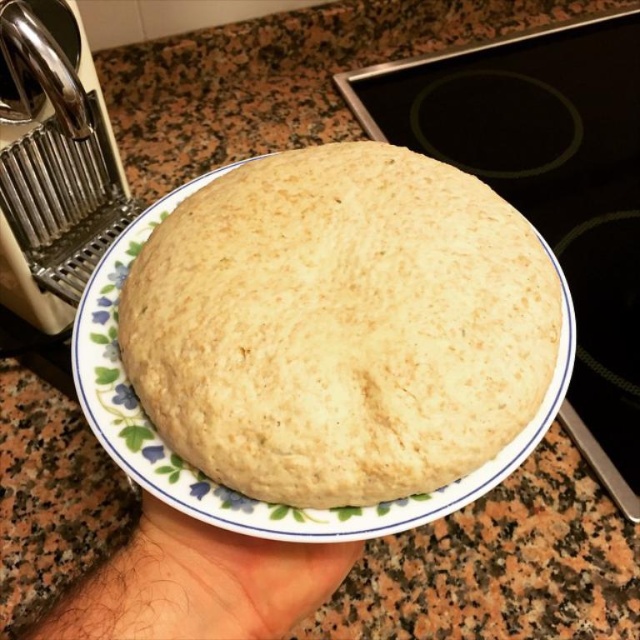
Question: Does golden matte bread at center have a larger size compared to brushed metal pasta machine at upper left?

Choices:
 (A) yes
 (B) no

Answer: (B)

Question: Based on their relative distances, which object is farther from the smooth skin at lower center?

Choices:
 (A) brushed metal pasta machine at upper left
 (B) golden matte bread at center

Answer: (A)

Question: Is golden matte bread at center closer to the viewer compared to smooth skin at lower center?

Choices:
 (A) yes
 (B) no

Answer: (A)

Question: Which point is closer to the camera taking this photo?

Choices:
 (A) (298, 246)
 (B) (61, 282)
 (C) (134, 592)

Answer: (C)

Question: Can you confirm if golden matte bread at center is smaller than smooth skin at lower center?

Choices:
 (A) no
 (B) yes

Answer: (A)

Question: Among these objects, which one is nearest to the camera?

Choices:
 (A) golden matte bread at center
 (B) brushed metal pasta machine at upper left
 (C) smooth skin at lower center

Answer: (A)